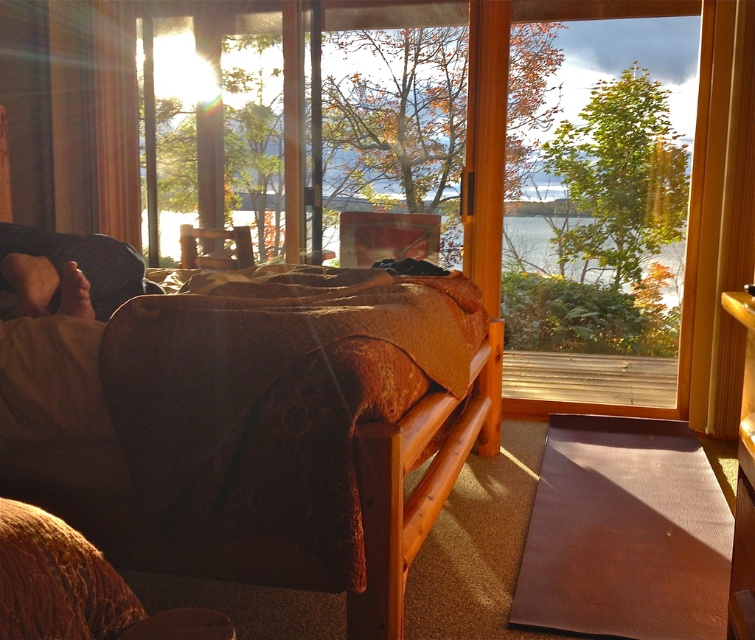
Question: Is transparent glass window at center thinner than velvet brown couch at lower left?

Choices:
 (A) no
 (B) yes

Answer: (A)

Question: Among these objects, which one is farthest from the camera?

Choices:
 (A) transparent glass window at center
 (B) brown matte yoga mat at lower right

Answer: (A)

Question: Considering the relative positions of brown matte yoga mat at lower right and transparent glass window at center in the image provided, where is brown matte yoga mat at lower right located with respect to transparent glass window at center?

Choices:
 (A) left
 (B) right

Answer: (B)

Question: Which object is farther from the camera taking this photo?

Choices:
 (A) velvet brown couch at lower left
 (B) brown matte yoga mat at lower right
 (C) brown woven bed at center

Answer: (B)

Question: Which point is closer to the camera?

Choices:
 (A) brown textured fabric at left
 (B) brown woven bed at center

Answer: (B)

Question: Is the position of brown woven bed at center more distant than that of velvet brown couch at lower left?

Choices:
 (A) yes
 (B) no

Answer: (A)